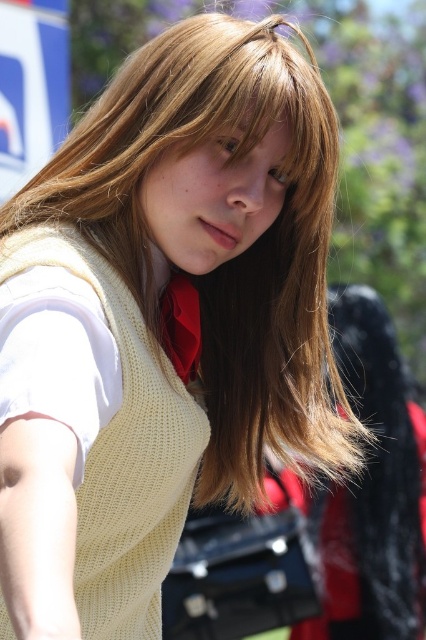
You are a photographer setting up for a portrait. The subject is wearing a light yellow knitted sweater at center and a matte red tie at center. You need to ensure there is at least 10 inches of space between their clothing items to avoid clutter in the photo. Based on the scene description, will the current positioning meet your requirement?

The light yellow knitted sweater at center and matte red tie at center are 8.27 inches apart from each other, which is less than the required 10 inches. Therefore, the current positioning does not meet the requirement and may appear cluttered in the photo.

From the picture: You are standing 2 meters away from the person in the image. If you want to hand them a book, which point should you aim for to reach their hands? The point is located at coordinates point (230,365).

The point (230,365) is 1.91 meters away from the viewer, which is within the 2 meters distance. Therefore, aiming for point (230,365) would allow you to reach their hands.

You are a photographer trying to position a light source for a portrait. The subject has blonde hair at center. Where should you place the light source to ensure the hair is highlighted? Use the coordinates provided to determine the best position.

The blonde hair at center is located at coordinates point (x=227, y=260). To highlight the hair, position the light source slightly above and behind the subject at those coordinates to create a halo effect.